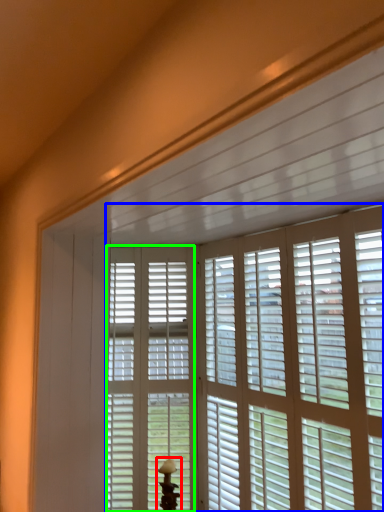
Question: Estimate the real-world distances between objects in this image. Which object is closer to table lamp (highlighted by a red box), window blind (highlighted by a blue box) or screen door (highlighted by a green box)?

Choices:
 (A) window blind
 (B) screen door

Answer: (B)